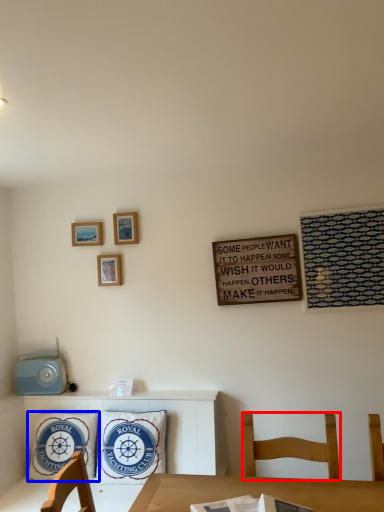
Question: Which object is closer to the camera taking this photo, chair (highlighted by a red box) or pillow (highlighted by a blue box)?

Choices:
 (A) chair
 (B) pillow

Answer: (A)